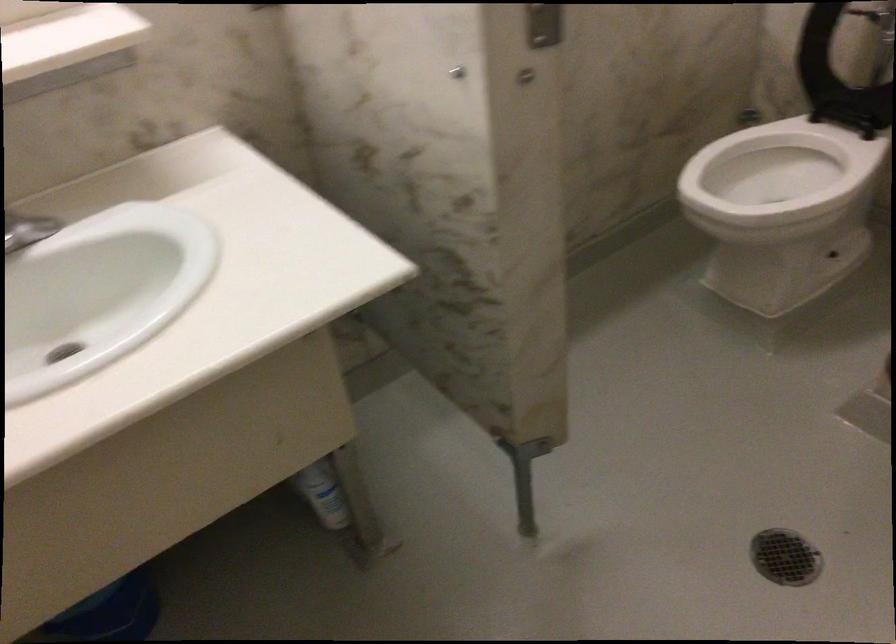
Where would you lower the white toilet lid? Please return your answer as a coordinate pair (x, y).

(836, 75)